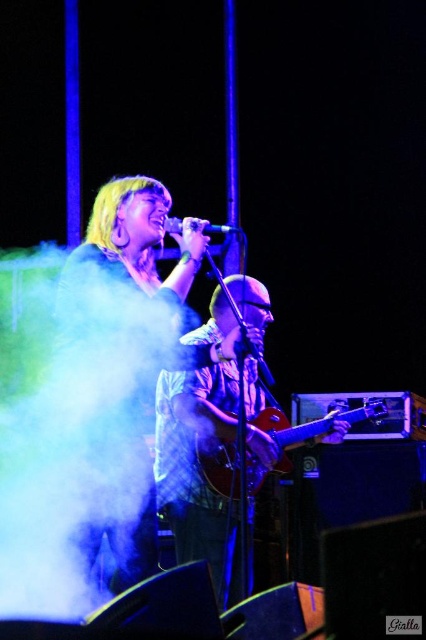
Question: Can you confirm if white fog at center is positioned above black matte microphone at center?

Choices:
 (A) yes
 (B) no

Answer: (B)

Question: Which of the following is the closest to the observer?

Choices:
 (A) glossy wood guitar at center
 (B) black matte microphone at center
 (C) white fog at center

Answer: (C)

Question: Which point is farther to the camera?

Choices:
 (A) (172, 224)
 (B) (80, 540)

Answer: (A)

Question: Which point appears farthest from the camera in this image?

Choices:
 (A) (103, 492)
 (B) (256, 472)

Answer: (B)

Question: Does white fog at center lie behind black matte microphone at center?

Choices:
 (A) yes
 (B) no

Answer: (B)

Question: Is white fog at center smaller than glossy wood guitar at center?

Choices:
 (A) yes
 (B) no

Answer: (B)